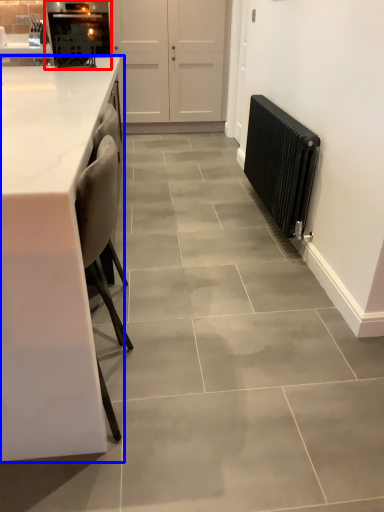
Question: Which point is closer to the camera, appliance (highlighted by a red box) or countertop (highlighted by a blue box)?

Choices:
 (A) appliance
 (B) countertop

Answer: (B)